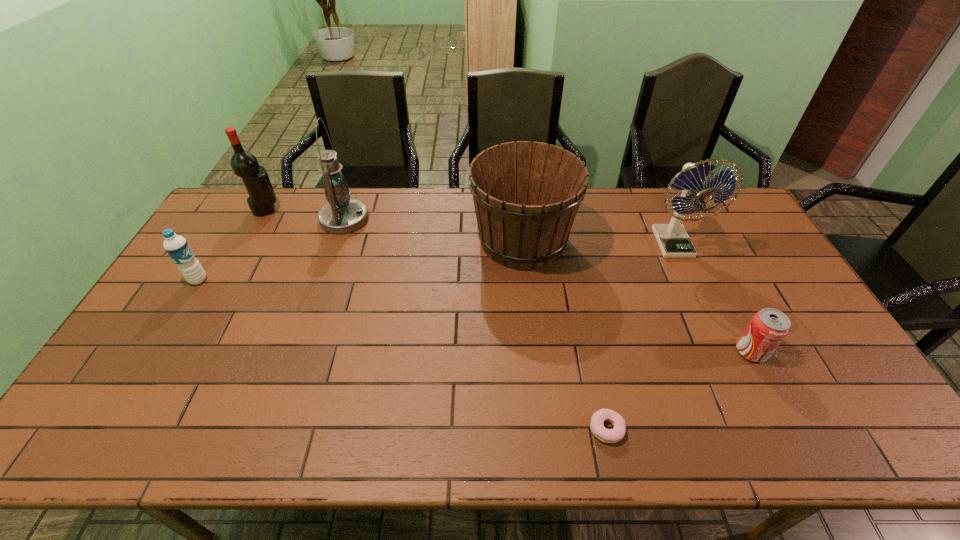
Locate an element on the screen. The height and width of the screenshot is (540, 960). oil lamp is located at coordinates (342, 215).

Find the location of a particular element. The image size is (960, 540). fan is located at coordinates (673, 240).

Find the location of a particular element. Image resolution: width=960 pixels, height=540 pixels. wine bottle is located at coordinates (244, 164).

Locate an element on the screen. the fourth tallest object is located at coordinates (526, 195).

The height and width of the screenshot is (540, 960). What are the coordinates of `the leftmost object` in the screenshot? It's located at (176, 246).

The height and width of the screenshot is (540, 960). Find the location of `water bottle`. water bottle is located at coordinates (176, 246).

Find the location of a particular element. This screenshot has height=540, width=960. soda can is located at coordinates (767, 329).

At what (x,y) coordinates should I click in order to perform the action: click on the sixth farthest object. Please return your answer as a coordinate pair (x, y). This screenshot has width=960, height=540. Looking at the image, I should click on (767, 329).

Locate an element on the screen. Image resolution: width=960 pixels, height=540 pixels. doughnut is located at coordinates (614, 435).

Identify the location of the shortest object. (614, 435).